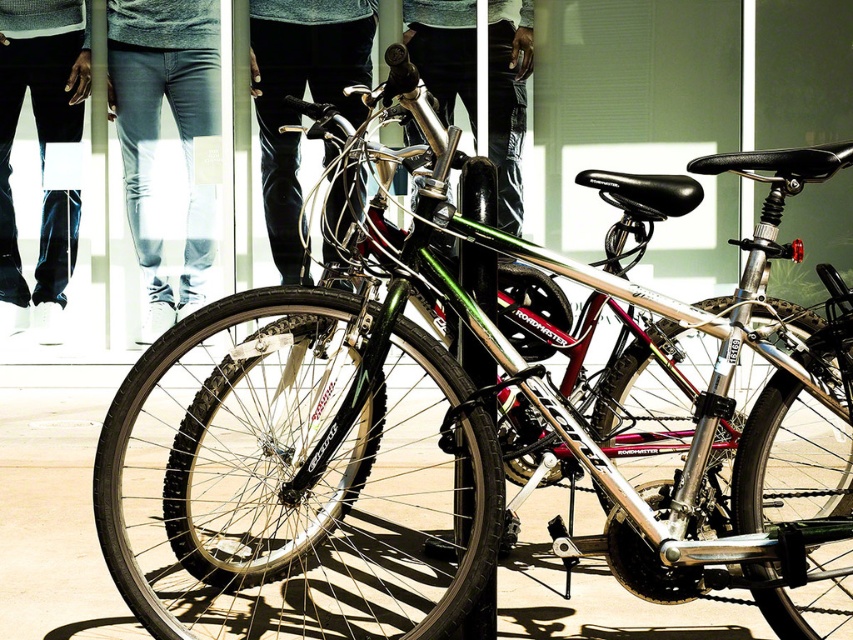
Question: Is denim jeans at center smaller than metallic silver bicycle at center?

Choices:
 (A) yes
 (B) no

Answer: (A)

Question: Which is nearer to the smooth concrete pavement at center?

Choices:
 (A) black leather pants at center
 (B) denim jeans at center
 (C) dark blue jeans at lower left

Answer: (C)

Question: Which is nearer to the dark blue jeans at lower left?

Choices:
 (A) metallic silver bicycle at center
 (B) smooth concrete pavement at center

Answer: (B)

Question: Does denim jeans at center have a lesser width compared to dark blue jeans at lower left?

Choices:
 (A) yes
 (B) no

Answer: (B)

Question: Which point is farther to the camera?

Choices:
 (A) (265, 172)
 (B) (26, 61)
 (C) (515, 163)

Answer: (A)

Question: Can you confirm if smooth concrete pavement at center is smaller than denim jeans at center?

Choices:
 (A) no
 (B) yes

Answer: (B)